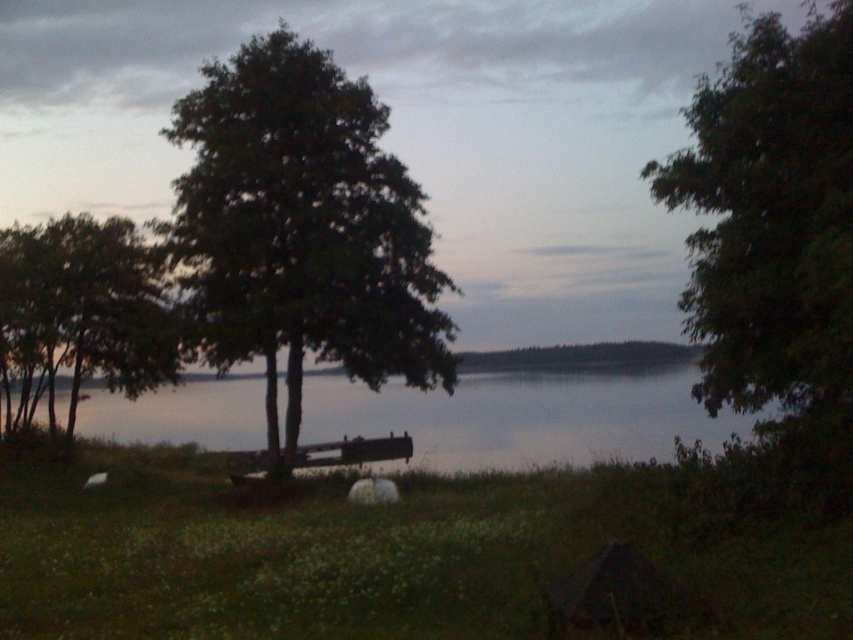
Does point (480, 481) come behind point (395, 394)?

No, (480, 481) is in front of (395, 394).

Is green grassy at center bigger than smooth water at center?

Incorrect, green grassy at center is not larger than smooth water at center.

Image resolution: width=853 pixels, height=640 pixels. What do you see at coordinates (393, 552) in the screenshot? I see `green grassy at center` at bounding box center [393, 552].

The height and width of the screenshot is (640, 853). Find the location of `green grassy at center`. green grassy at center is located at coordinates (393, 552).

Which is below, green leafy tree at center or green leafy tree at right?

green leafy tree at center

Is green leafy tree at center closer to the viewer compared to green leafy tree at right?

No, it is not.

Which is behind, point (312, 84) or point (808, 472)?

The point (312, 84) is behind.

The height and width of the screenshot is (640, 853). What are the coordinates of `green leafy tree at center` in the screenshot? It's located at (302, 228).

How far apart are green leafy tree at right and smooth water at center?

green leafy tree at right is 22.49 meters away from smooth water at center.

Between point (839, 323) and point (566, 456), which one is positioned behind?

Positioned behind is point (566, 456).

Identify the location of green leafy tree at right. This screenshot has height=640, width=853. (775, 237).